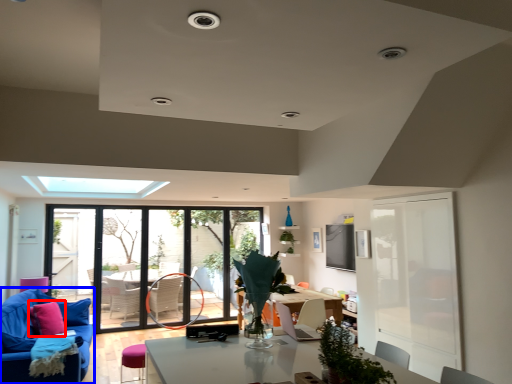
Question: Which of the following is the farthest to the observer, pillow (highlighted by a red box) or studio couch (highlighted by a blue box)?

Choices:
 (A) pillow
 (B) studio couch

Answer: (A)